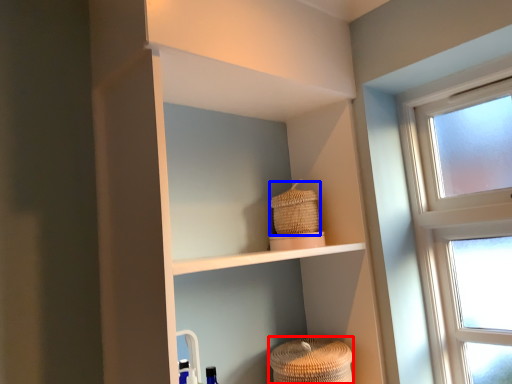
Question: Which point is further to the camera, basket (highlighted by a red box) or basket (highlighted by a blue box)?

Choices:
 (A) basket
 (B) basket

Answer: (B)